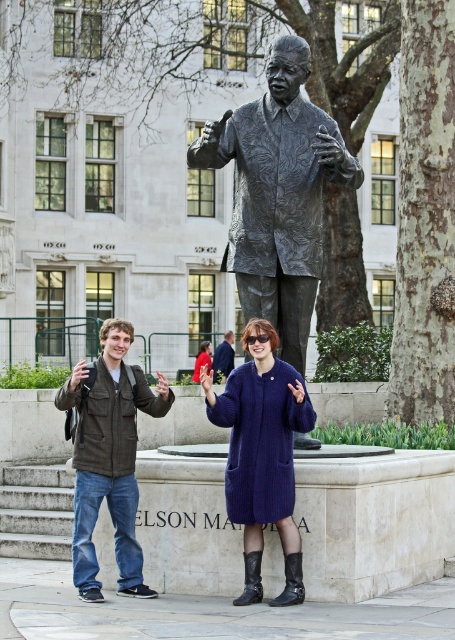
You are standing in front of the Nelson Mandela statue in the public square. You want to take a photo of the statue with your camera, which has a focal length of 50mm. The recommended distance for this camera to capture the entire statue in the frame is 15 meters. Is the point at coordinates point (126, 321) within the recommended distance for taking the photo?

The point at coordinates point (126, 321) is 19.33 meters away from the viewer. Since the recommended distance is 15 meters, the point is beyond the recommended distance for capturing the entire statue in the frame.

You are a photographer trying to capture a photo of the bronze textured statue at center and the navy wool coat at center. Based on their positions, which object should you focus on first if you want to include both in your shot without moving the camera?

The bronze textured statue at center is positioned on the right side of the navy wool coat at center, so you should focus on the navy wool coat at center first since it is closer to the camera and occupies the left side of the frame, allowing the statue to naturally fall into the right side of the composition without needing to adjust the camera position.

You are a photographer trying to capture both the navy wool coat at center and the matte blue coat at center in a single frame. Since the statue of Nelson Mandela is in the background, which coat should you focus on to ensure both are in focus?

The navy wool coat at center is taller than the matte blue coat at center, so focusing on the taller navy wool coat at center will help ensure both are in focus as they are at similar distances.